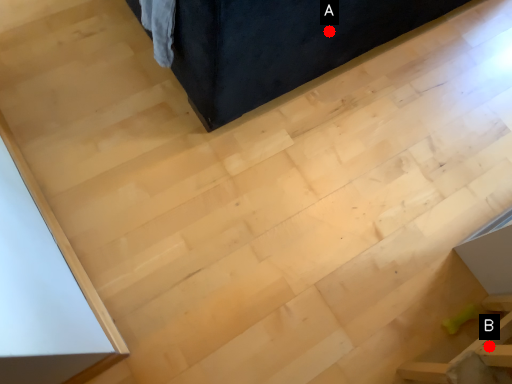
Question: Two points are circled on the image, labeled by A and B beside each circle. Which point is farther to the camera?

Choices:
 (A) A is further
 (B) B is further

Answer: (A)